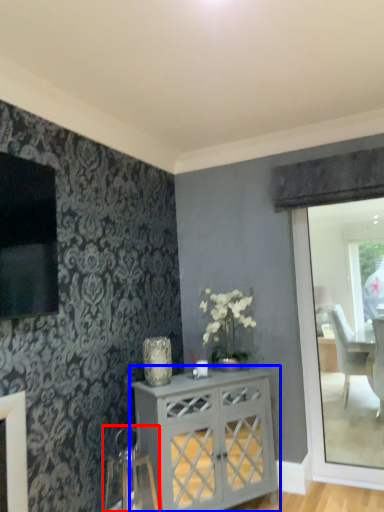
Question: Which point is closer to the camera, swivel chair (highlighted by a red box) or desk (highlighted by a blue box)?

Choices:
 (A) swivel chair
 (B) desk

Answer: (A)